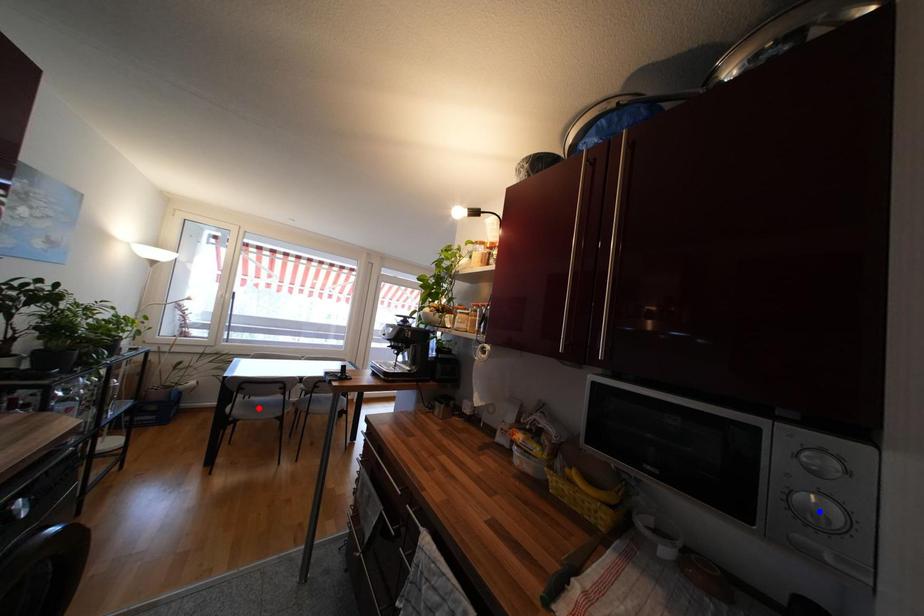
Question: Two points are marked on the image. Which point is closer to the camera?

Choices:
 (A) Blue point is closer.
 (B) Red point is closer.

Answer: (A)